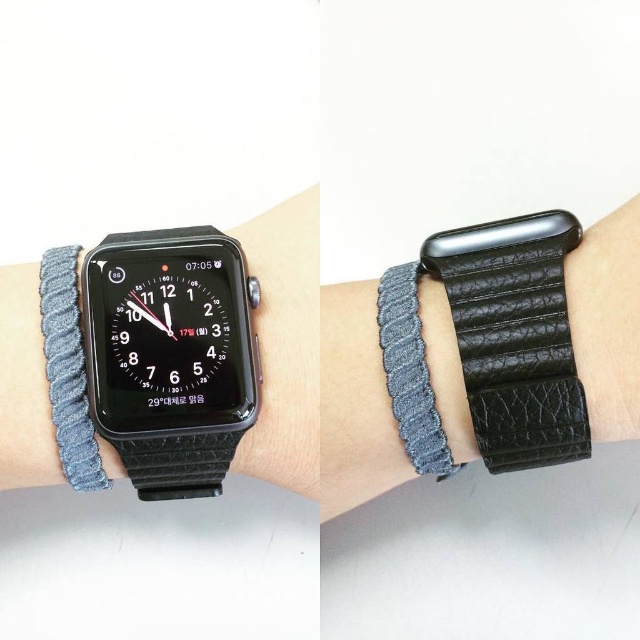
Question: Which of these objects is positioned farthest from the black leather wristband at center?

Choices:
 (A) gray woven bracelet at center
 (B) black leather watch at left

Answer: (B)

Question: Which object is the closest to the gray woven bracelet at center?

Choices:
 (A) denim woven band at left
 (B) black leather wristband at center
 (C) black leather watch at left

Answer: (B)

Question: Does denim woven band at left appear on the right side of gray woven bracelet at center?

Choices:
 (A) yes
 (B) no

Answer: (B)

Question: Which of these objects is positioned closest to the black leather wristband at center?

Choices:
 (A) black leather watch at left
 (B) gray woven bracelet at center

Answer: (B)

Question: Where is denim woven band at left located in relation to gray woven bracelet at center in the image?

Choices:
 (A) left
 (B) right

Answer: (A)

Question: Can you confirm if black leather watch at left is bigger than gray woven bracelet at center?

Choices:
 (A) yes
 (B) no

Answer: (A)